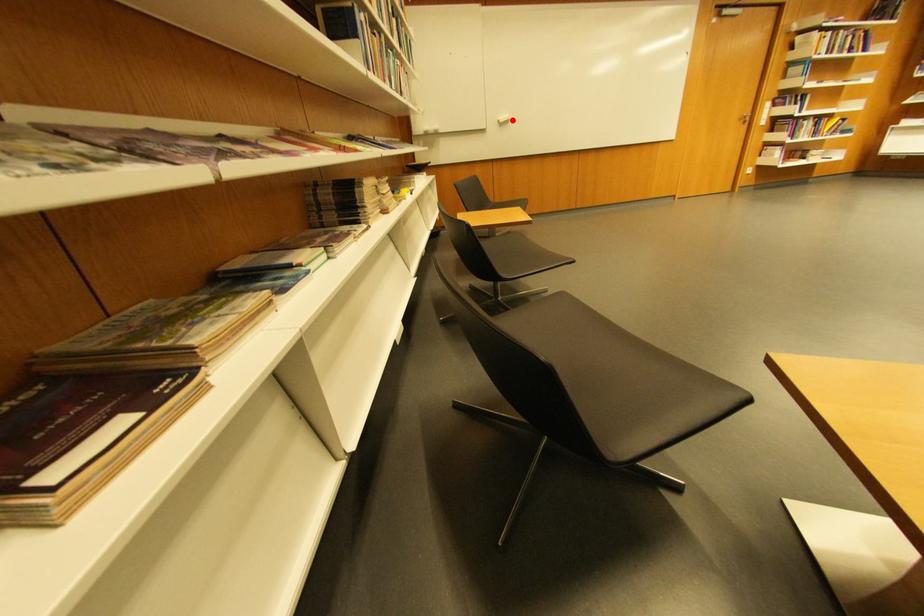
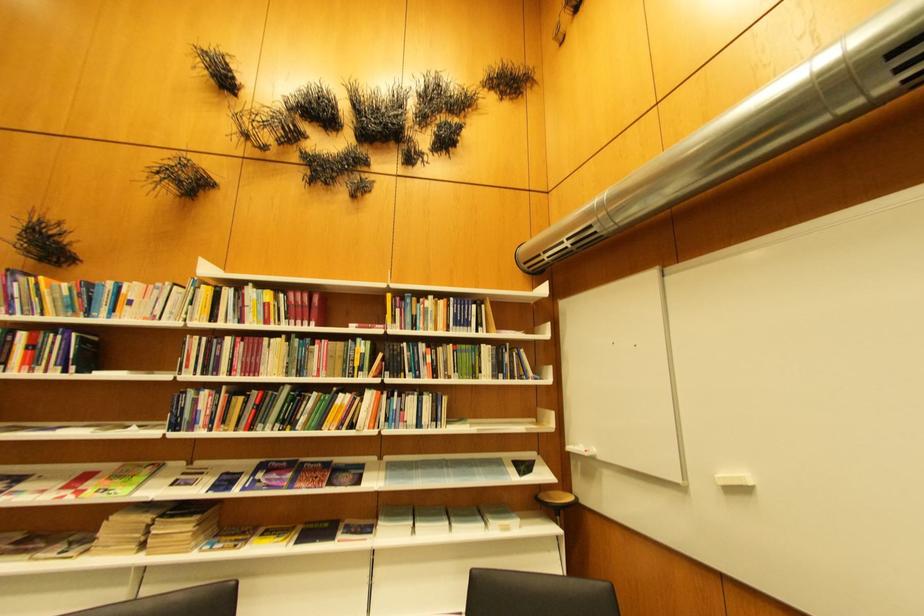
Question: I am providing you with two images of the same scene from different viewpoints. A red point is marked on the first image. Is the red point's position out of view in image 2?

Choices:
 (A) Yes
 (B) No

Answer: (B)